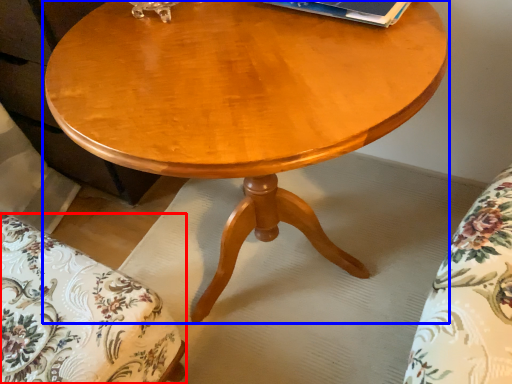
Question: Which object appears farthest to the camera in this image, swivel chair (highlighted by a red box) or coffee table (highlighted by a blue box)?

Choices:
 (A) swivel chair
 (B) coffee table

Answer: (A)